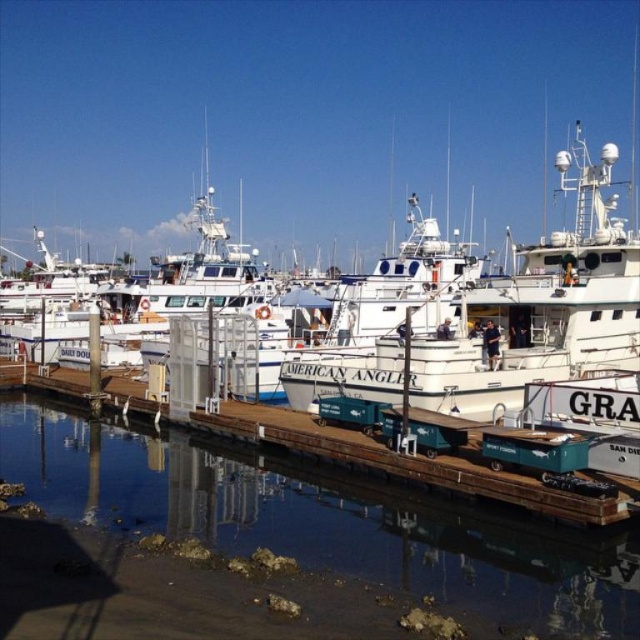
You are a boat operator who needs to dock the white matte boat at center. The safety regulations state that the distance between the boat and the dock edge must be at least 15 meters to avoid collision with the clear water at dock center. Is the current distance sufficient?

The clear water at dock center is 17.12 meters from the white matte boat at center. Since 17.12 meters exceeds the required 15 meters, the current distance is sufficient to comply with safety regulations and avoid collision.

You are standing at the camera position observing the marina scene. There is a point at coordinates point (x=308, y=461). Can you reach that point without moving your position?

The distance between point (x=308, y=461) and the camera is 30.22 meters. Since you are at the camera position, you cannot physically reach the point unless you move towards it.

Based on the photo, you are a boat captain planning to dock your vessel at the marina. The dock has a clear water area at its center. Based on the coordinates provided, where should you aim to position your boat relative to the clear water at dock center?

The clear water at dock center is located at coordinates point (x=324, y=518). You should aim to position your boat near this point to ensure proper alignment with the dock.